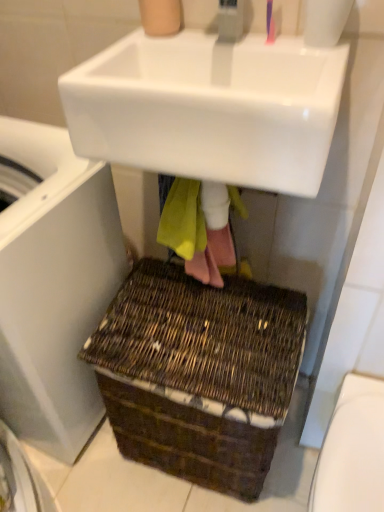
Question: From a real-world perspective, is white glossy sink at upper center on white plastic washing machine at lower left?

Choices:
 (A) yes
 (B) no

Answer: (A)

Question: Does white glossy sink at upper center come behind white plastic washing machine at lower left?

Choices:
 (A) no
 (B) yes

Answer: (A)

Question: Does white glossy sink at upper center have a lesser width compared to white plastic washing machine at lower left?

Choices:
 (A) no
 (B) yes

Answer: (B)

Question: From the image's perspective, is white glossy sink at upper center under white plastic washing machine at lower left?

Choices:
 (A) no
 (B) yes

Answer: (A)

Question: Does white glossy sink at upper center have a larger size compared to white plastic washing machine at lower left?

Choices:
 (A) no
 (B) yes

Answer: (A)

Question: Does white glossy sink at upper center contain white plastic washing machine at lower left?

Choices:
 (A) yes
 (B) no

Answer: (B)

Question: Is pink plastic toothbrush at upper center bigger than brown woven basket at lower center?

Choices:
 (A) yes
 (B) no

Answer: (B)

Question: From the image's perspective, is pink plastic toothbrush at upper center beneath brown woven basket at lower center?

Choices:
 (A) no
 (B) yes

Answer: (A)

Question: Can you confirm if pink plastic toothbrush at upper center is thinner than brown woven basket at lower center?

Choices:
 (A) yes
 (B) no

Answer: (A)

Question: Considering the relative sizes of pink plastic toothbrush at upper center and brown woven basket at lower center in the image provided, is pink plastic toothbrush at upper center smaller than brown woven basket at lower center?

Choices:
 (A) yes
 (B) no

Answer: (A)

Question: Does pink plastic toothbrush at upper center lie behind brown woven basket at lower center?

Choices:
 (A) yes
 (B) no

Answer: (B)

Question: Is pink plastic toothbrush at upper center to the right of brown woven basket at lower center from the viewer's perspective?

Choices:
 (A) no
 (B) yes

Answer: (B)

Question: Would you say white plastic washing machine at lower left is part of white glossy toilet bowl at lower right's contents?

Choices:
 (A) yes
 (B) no

Answer: (B)